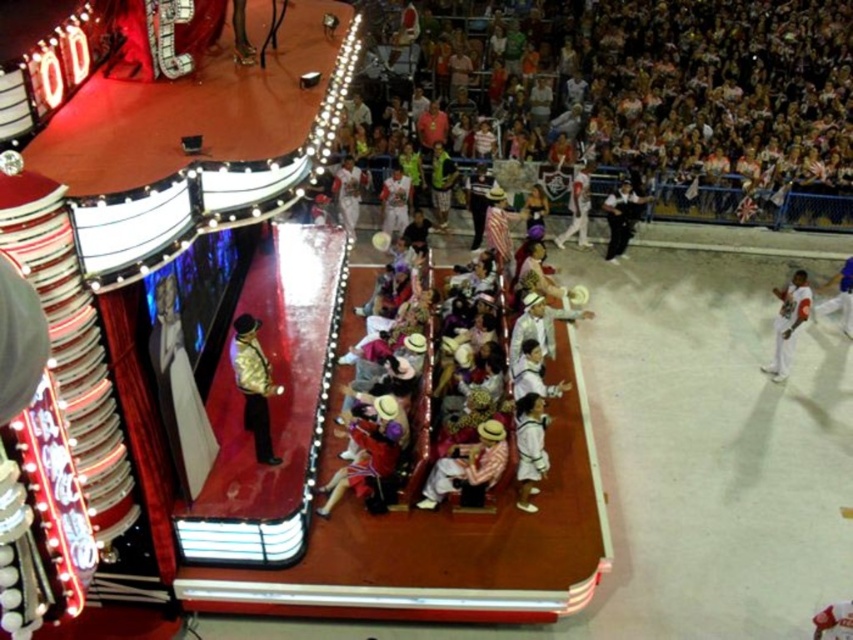
Question: Can you confirm if white cotton pants at center is thinner than white cotton shirt at right?

Choices:
 (A) yes
 (B) no

Answer: (B)

Question: Is gold metallic suit at center above white cotton pants at center?

Choices:
 (A) no
 (B) yes

Answer: (A)

Question: Among these points, which one is farthest from the camera?

Choices:
 (A) (521, 497)
 (B) (624, 209)
 (C) (793, 332)
 (D) (564, 241)

Answer: (D)

Question: Can you confirm if white baseball uniform at right is positioned above white cotton shirt at upper right?

Choices:
 (A) no
 (B) yes

Answer: (A)

Question: Which point appears farthest from the camera in this image?

Choices:
 (A) (816, 305)
 (B) (618, 196)

Answer: (B)

Question: Which of the following is the closest to the observer?

Choices:
 (A) (524, 506)
 (B) (791, 304)
 (C) (848, 312)
 (D) (247, 314)

Answer: (A)